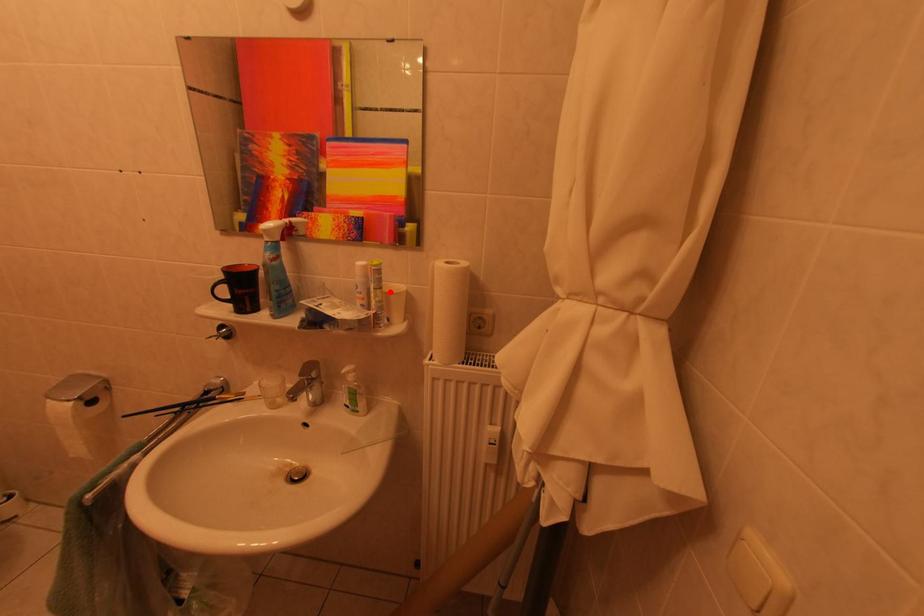
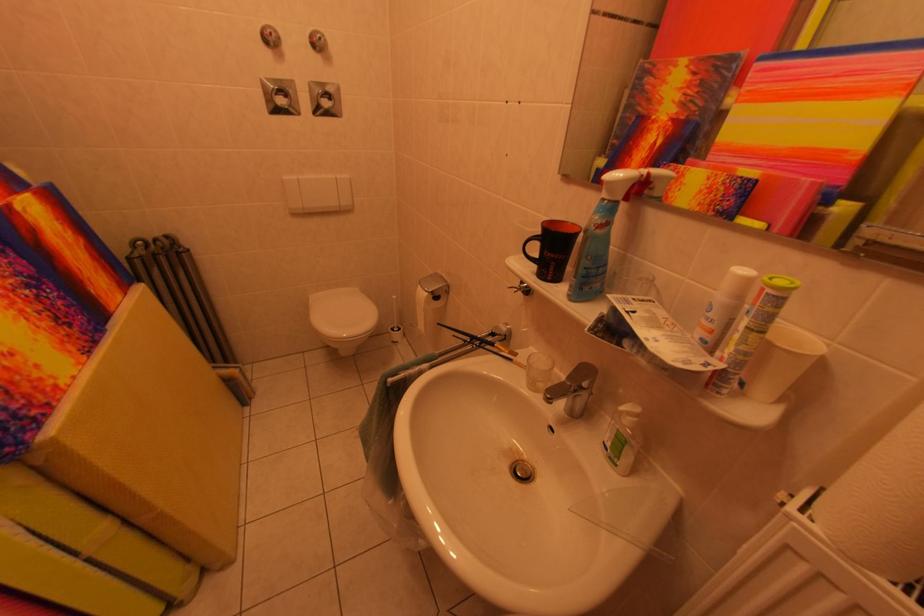
The point at the highlighted location is marked in the first image. Where is the corresponding point in the second image?

(773, 336)